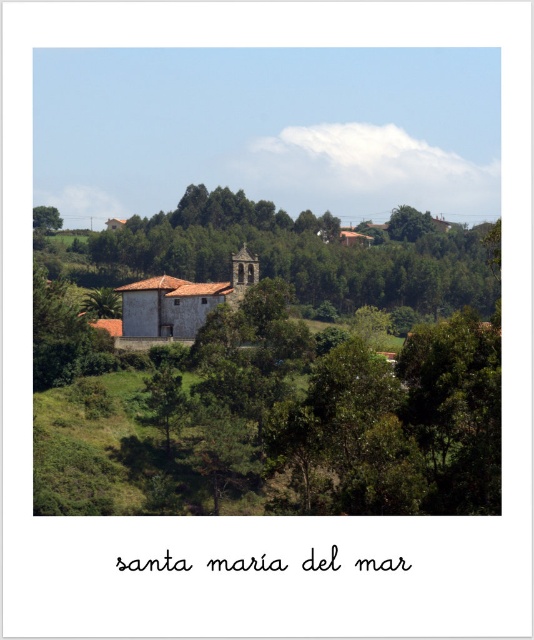
Is the position of green leafy tree at center less distant than that of brown wooden church at center?

Yes.

Does green leafy tree at center have a lesser width compared to brown wooden church at center?

No.

The image size is (534, 640). What do you see at coordinates (277, 368) in the screenshot? I see `green leafy tree at center` at bounding box center [277, 368].

Find the location of a particular element. The width and height of the screenshot is (534, 640). green leafy tree at center is located at coordinates (277, 368).